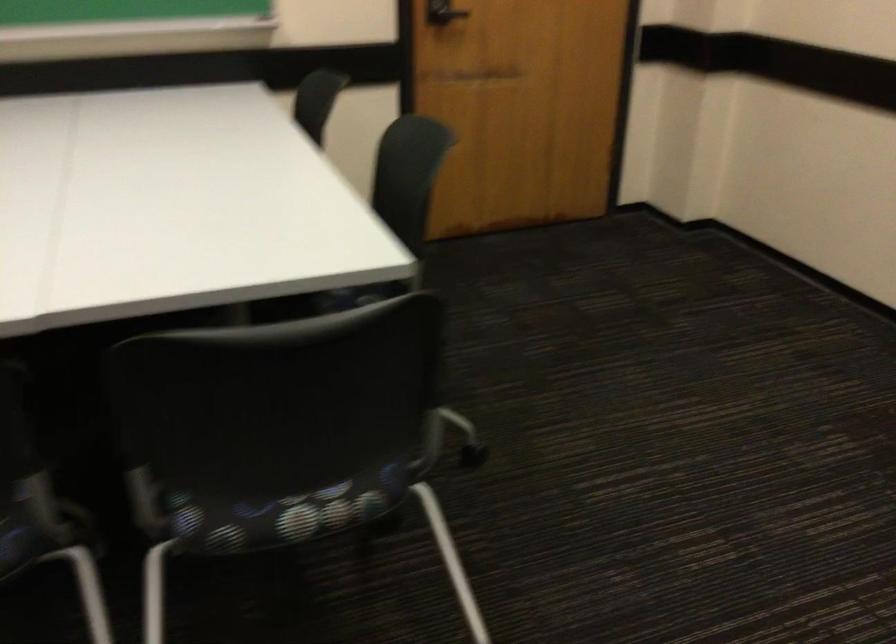
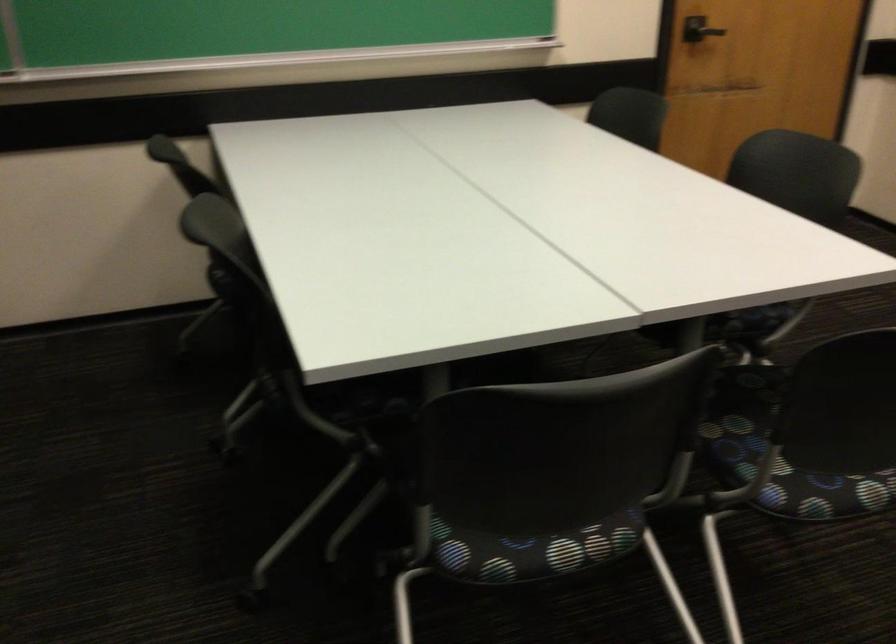
Question: What movement of the cameraman would produce the second image?

Choices:
 (A) Left
 (B) Right
 (C) Forward
 (D) Backward

Answer: (A)